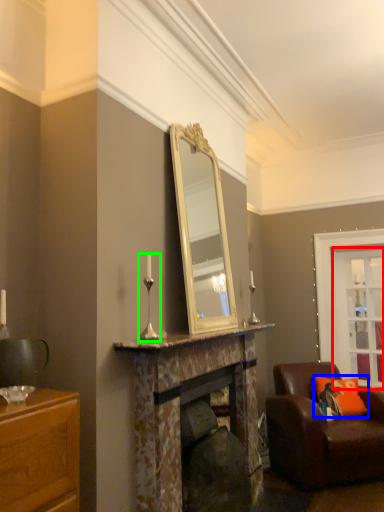
Question: Considering the real-world distances, which object is closest to glass door (highlighted by a red box)? pillow (highlighted by a blue box) or candle holder (highlighted by a green box).

Choices:
 (A) pillow
 (B) candle holder

Answer: (A)